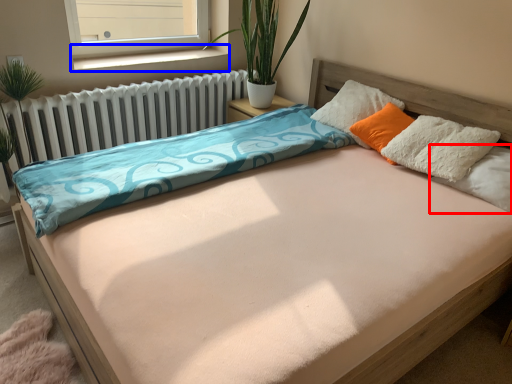
Question: Among these objects, which one is nearest to the camera, pillow (highlighted by a red box) or window sill (highlighted by a blue box)?

Choices:
 (A) pillow
 (B) window sill

Answer: (A)